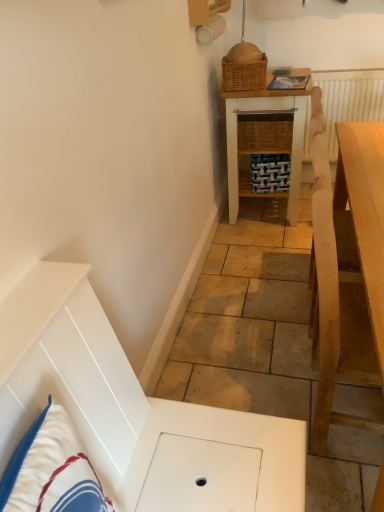
Question: In terms of width, does woven brown picnic basket at upper center look wider or thinner when compared to white cotton pillow at lower left?

Choices:
 (A) thin
 (B) wide

Answer: (B)

Question: In terms of size, does woven brown picnic basket at upper center appear bigger or smaller than white cotton pillow at lower left?

Choices:
 (A) small
 (B) big

Answer: (A)

Question: Which object is the farthest from the white textured radiator at upper right?

Choices:
 (A) woven brown picnic basket at upper center
 (B) light wood table at right, placed as the first table when sorted from front to back
 (C) woven wood table at center, which is the first table in back-to-front order
 (D) white cotton pillow at lower left

Answer: (D)

Question: Which object is positioned closest to the white textured radiator at upper right?

Choices:
 (A) woven brown picnic basket at upper center
 (B) light wood table at right, which appears as the 1th table when ordered from the bottom
 (C) woven wood table at center, which is counted as the second table, starting from the bottom
 (D) white cotton pillow at lower left

Answer: (C)